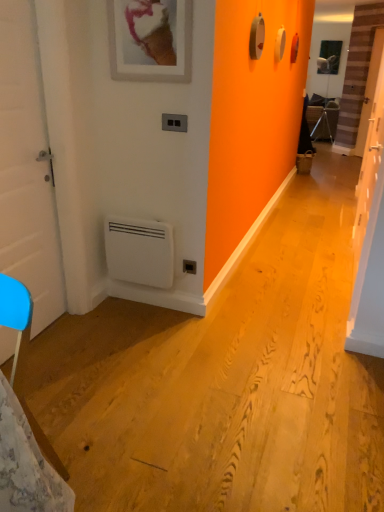
Find the location of a particular element. vacant space to the right of white matte door at left, which is counted as the 2th door, starting from the right is located at coordinates (94, 339).